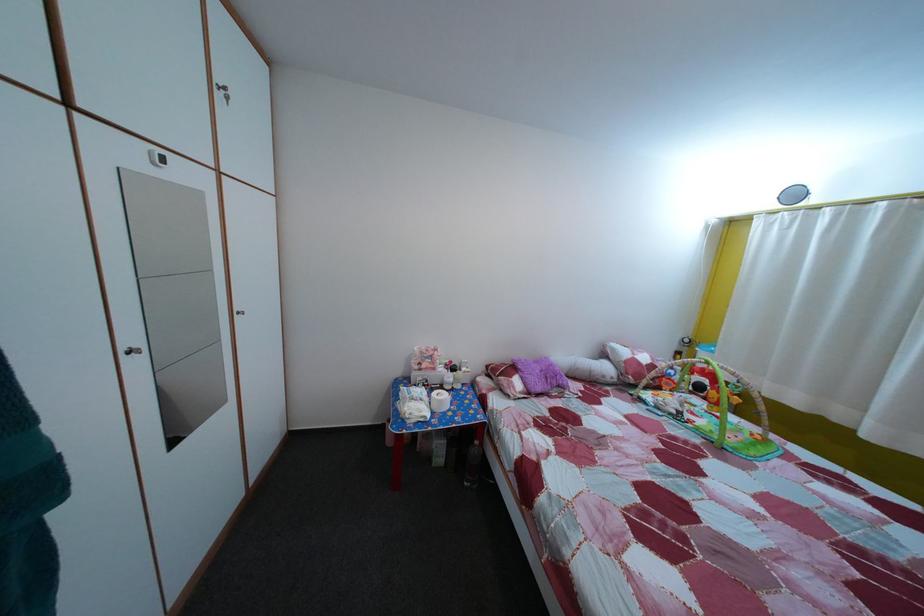
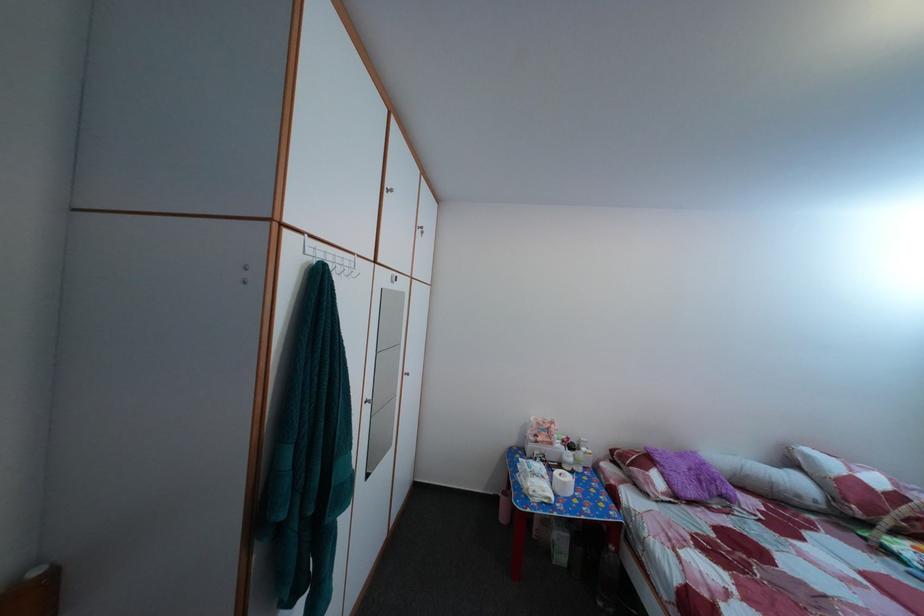
Question: I am providing you with two images of the same scene from different viewpoints. Please identify which objects are invisible in image2.

Choices:
 (A) paper towel roll
 (B) white and red pillow
 (C) white cylindrical pillow
 (D) none of these

Answer: (D)